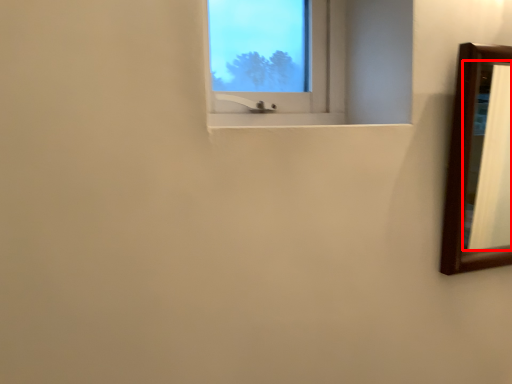
Question: Where is mirror (annotated by the red box) located in relation to window screen in the image?

Choices:
 (A) right
 (B) left

Answer: (A)